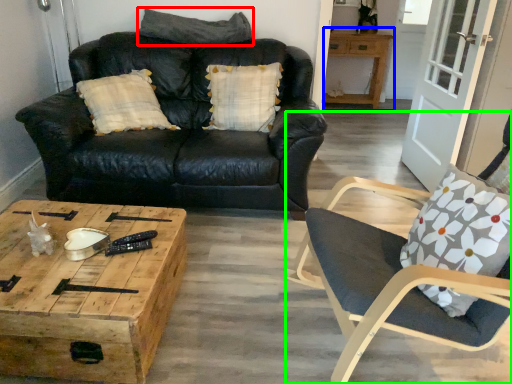
Question: Which object is positioned farthest from pillow (highlighted by a red box)? Select from table (highlighted by a blue box) and chair (highlighted by a green box).

Choices:
 (A) table
 (B) chair

Answer: (A)